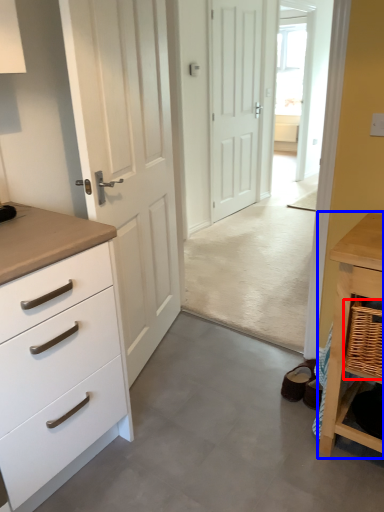
Question: Which object appears farthest to the camera in this image, basket (highlighted by a red box) or table (highlighted by a blue box)?

Choices:
 (A) basket
 (B) table

Answer: (B)